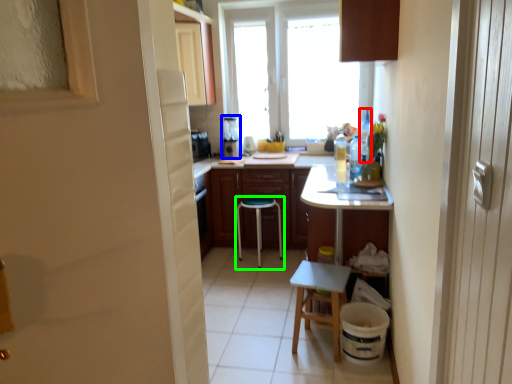
Question: Based on their relative distances, which object is nearer to bottle (highlighted by a red box)? Choose from appliance (highlighted by a blue box) and stool (highlighted by a green box).

Choices:
 (A) appliance
 (B) stool

Answer: (B)